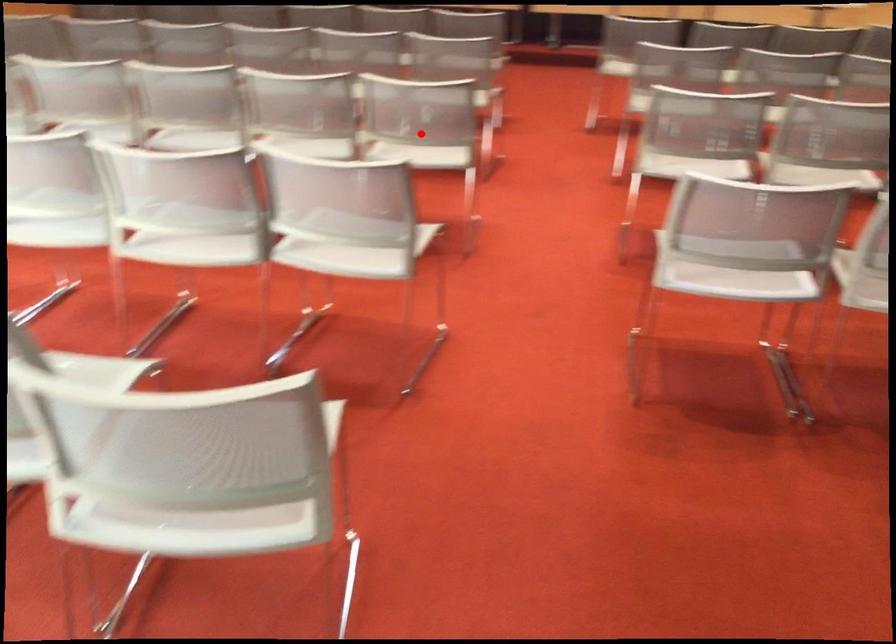
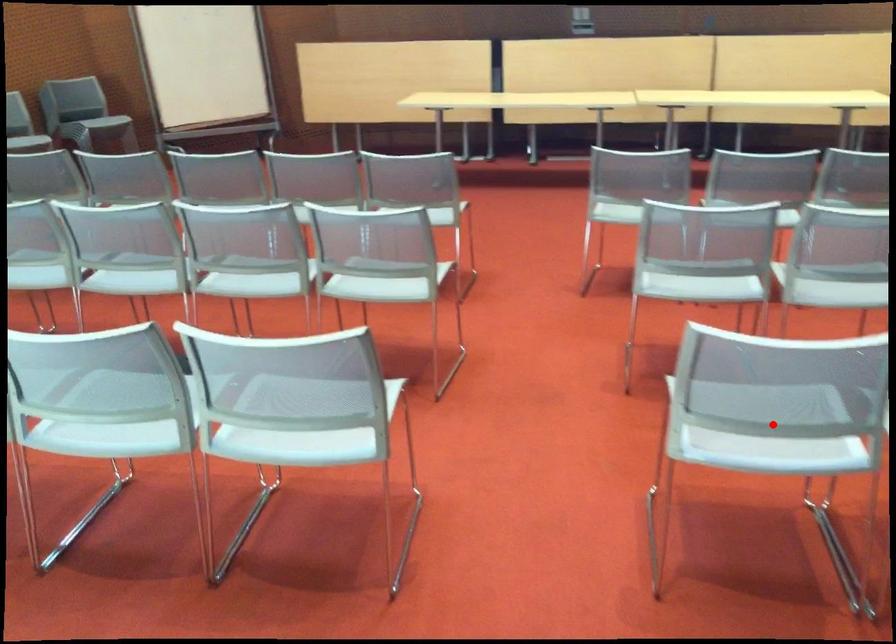
I am providing you with two images of the same scene from different viewpoints. A red point is marked on the first image and another point is marked on the second image. Is the marked point in image1 the same physical position as the marked point in image2?

No